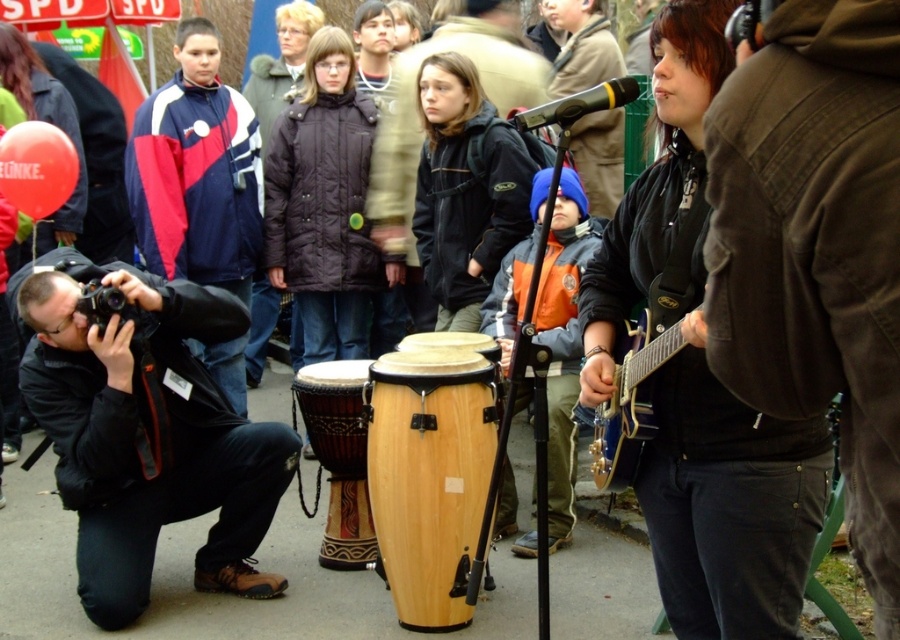
Question: Which object appears farthest from the camera in this image?

Choices:
 (A) black fabric camera at lower left
 (B) black matte jacket at center
 (C) natural wood drum at center
 (D) matte blue and red jacket at left

Answer: (D)

Question: Estimate the real-world distances between objects in this image. Which object is closer to the wooden drum at center?

Choices:
 (A) black fabric camera at lower left
 (B) glossy wood guitar at right
 (C) matte blue and red jacket at left

Answer: (A)

Question: Which of the following is the farthest from the observer?

Choices:
 (A) glossy wood guitar at right
 (B) wooden drum at center
 (C) natural wood drum at center

Answer: (B)

Question: Observing the image, what is the correct spatial positioning of wooden drum at center in reference to glossy wood guitar at right?

Choices:
 (A) left
 (B) right

Answer: (A)

Question: Can you confirm if natural wood drum at center is wider than matte blue and red jacket at left?

Choices:
 (A) no
 (B) yes

Answer: (A)

Question: Does black fabric camera at lower left appear on the right side of glossy wood guitar at right?

Choices:
 (A) yes
 (B) no

Answer: (B)